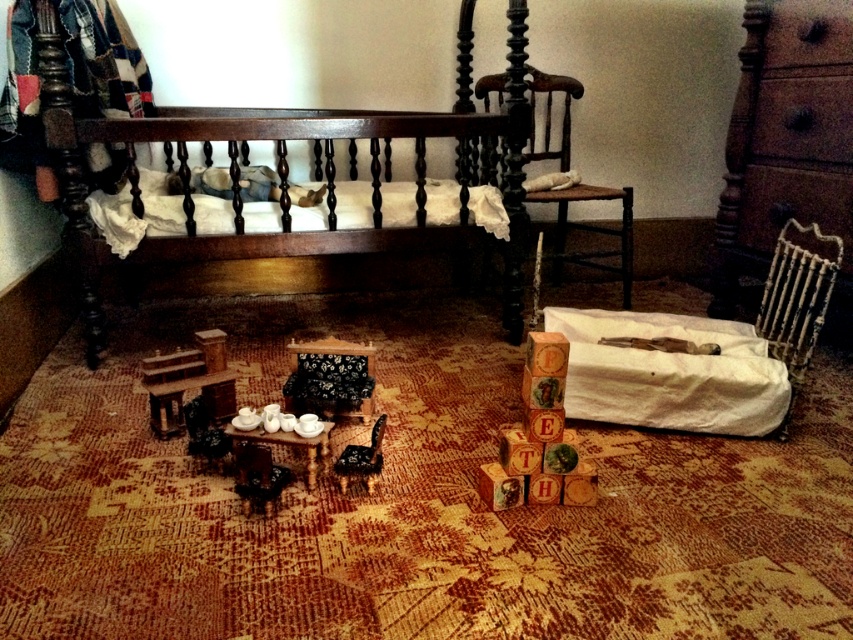
Question: Which object appears closest to the camera in this image?

Choices:
 (A) black fabric chair at center
 (B) dark wood bed at upper left
 (C) black floral fabric chair at center

Answer: (A)

Question: Which object is the closest to the black floral fabric chair at center?

Choices:
 (A) wooden glossy chair at center
 (B) wooden blocks at center

Answer: (A)

Question: Among these points, which one is farthest from the camera?

Choices:
 (A) (250, 467)
 (B) (346, 456)

Answer: (B)

Question: Where is wooden blocks at center located in relation to black fabric chair at center in the image?

Choices:
 (A) right
 (B) left

Answer: (A)

Question: Can you confirm if wooden blocks at center is thinner than black fabric chair at center?

Choices:
 (A) no
 (B) yes

Answer: (A)

Question: Is dark brown wooden chair at center thinner than black fabric chair at center?

Choices:
 (A) no
 (B) yes

Answer: (A)